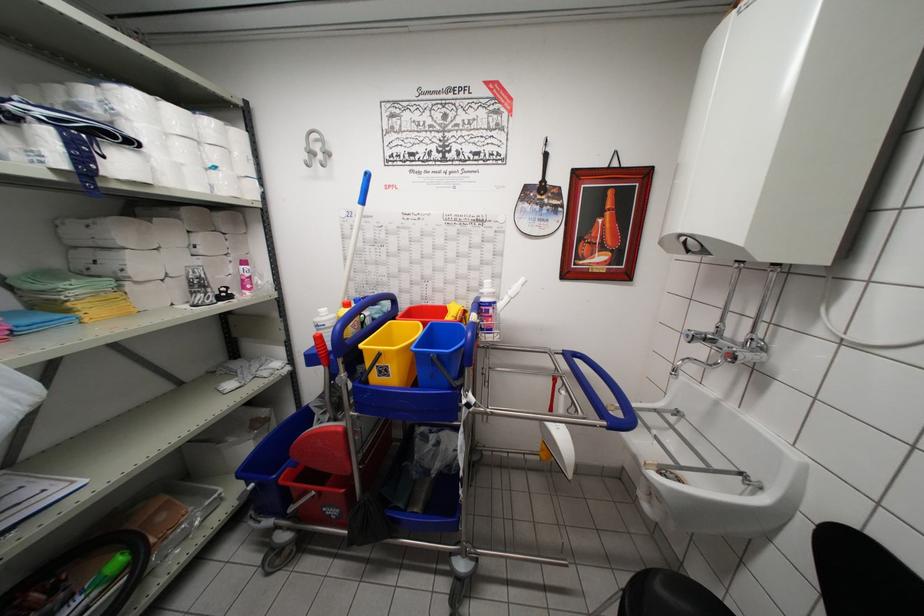
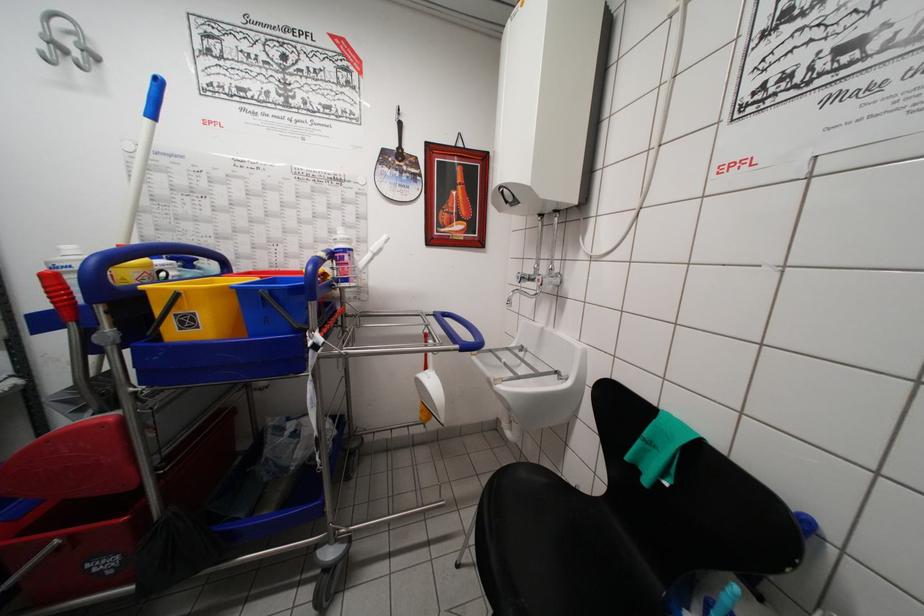
The point at (x=690, y=339) is marked in the first image. Where is the corresponding point in the second image?

(521, 282)